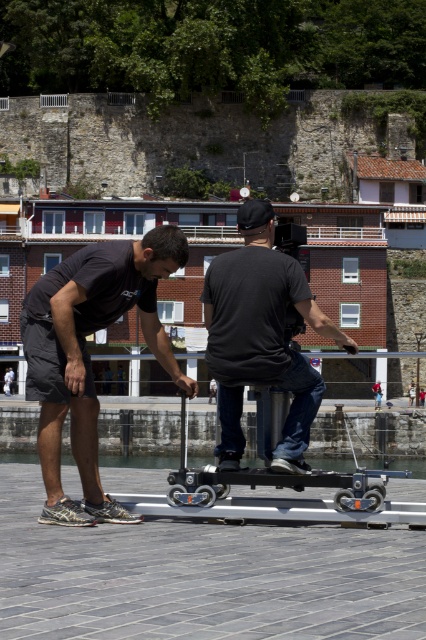
Question: Among these points, which one is nearest to the camera?

Choices:
 (A) (235, 340)
 (B) (89, 477)

Answer: (B)

Question: Does matte black skateboard at left appear over black matte scooter at center?

Choices:
 (A) no
 (B) yes

Answer: (A)

Question: Does matte black skateboard at left have a smaller size compared to black matte scooter at center?

Choices:
 (A) yes
 (B) no

Answer: (B)

Question: Is matte black skateboard at left closer to the viewer compared to black matte scooter at center?

Choices:
 (A) no
 (B) yes

Answer: (B)

Question: Which point is closer to the camera?

Choices:
 (A) black matte scooter at center
 (B) matte black skateboard at left

Answer: (B)